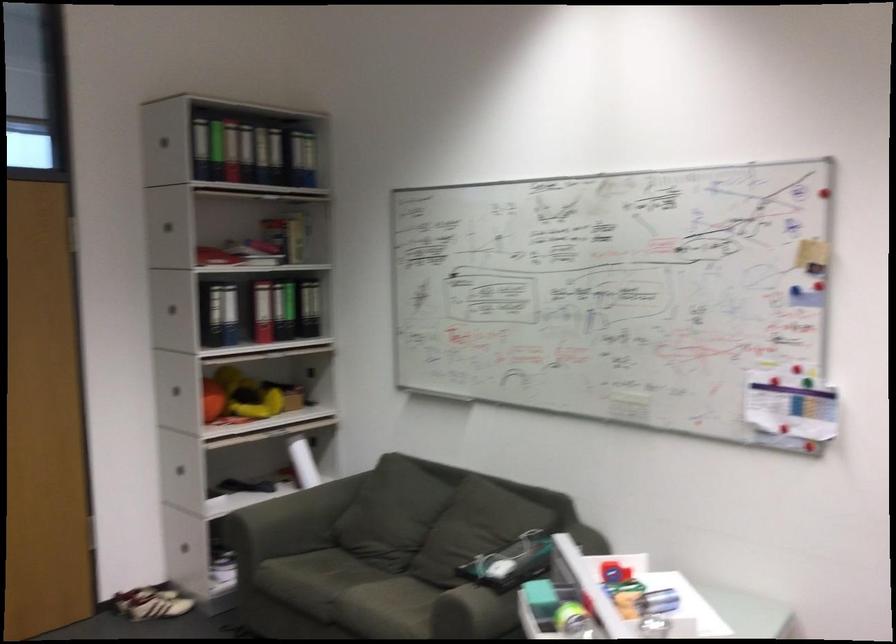
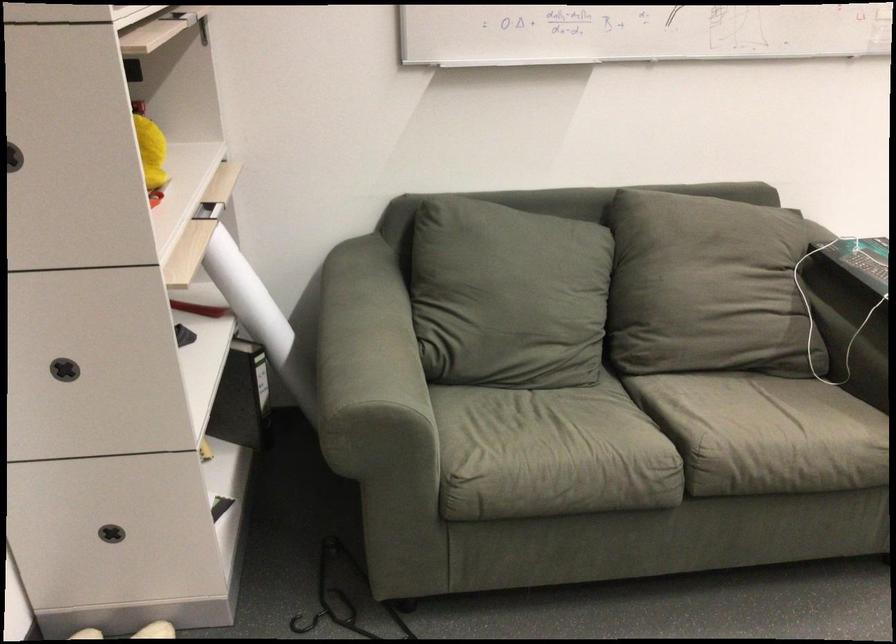
Where in the second image is the point corresponding to point (300, 488) from the first image?

(247, 296)